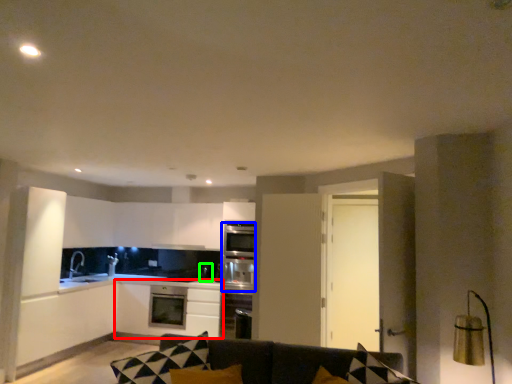
Question: Considering the real-world distances, which object is farthest from cabinetry (highlighted by a red box)? oven (highlighted by a blue box) or appliance (highlighted by a green box)?

Choices:
 (A) oven
 (B) appliance

Answer: (B)